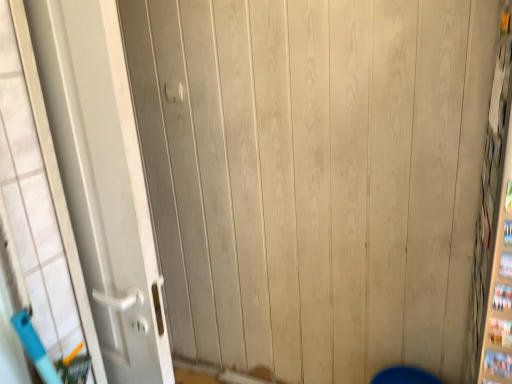
Question: Does white matte door at left have a larger size compared to white plastic door handle at upper center?

Choices:
 (A) no
 (B) yes

Answer: (B)

Question: Is white matte door at left closer to camera compared to white plastic door handle at upper center?

Choices:
 (A) yes
 (B) no

Answer: (A)

Question: Is white matte door at left looking in the opposite direction of white plastic door handle at upper center?

Choices:
 (A) no
 (B) yes

Answer: (A)

Question: Are white matte door at left and white plastic door handle at upper center located far from each other?

Choices:
 (A) no
 (B) yes

Answer: (A)

Question: Considering the relative sizes of white matte door at left and white plastic door handle at upper center in the image provided, is white matte door at left taller than white plastic door handle at upper center?

Choices:
 (A) yes
 (B) no

Answer: (A)

Question: Is white matte door at left to the left of white plastic door handle at upper center from the viewer's perspective?

Choices:
 (A) yes
 (B) no

Answer: (A)

Question: Can you see white plastic door handle at upper center touching white matte door at left?

Choices:
 (A) yes
 (B) no

Answer: (B)

Question: Can you confirm if white plastic door handle at upper center is wider than white matte door at left?

Choices:
 (A) yes
 (B) no

Answer: (B)

Question: Is white plastic door handle at upper center thinner than white matte door at left?

Choices:
 (A) no
 (B) yes

Answer: (B)

Question: Is white plastic door handle at upper center turned away from white matte door at left?

Choices:
 (A) no
 (B) yes

Answer: (A)

Question: Could white matte door at left be considered to be inside white plastic door handle at upper center?

Choices:
 (A) yes
 (B) no

Answer: (B)

Question: From a real-world perspective, is white plastic door handle at upper center under white matte door at left?

Choices:
 (A) no
 (B) yes

Answer: (A)

Question: Choose the correct answer: Is white matte door at left inside white plastic door handle at upper center or outside it?

Choices:
 (A) outside
 (B) inside

Answer: (A)